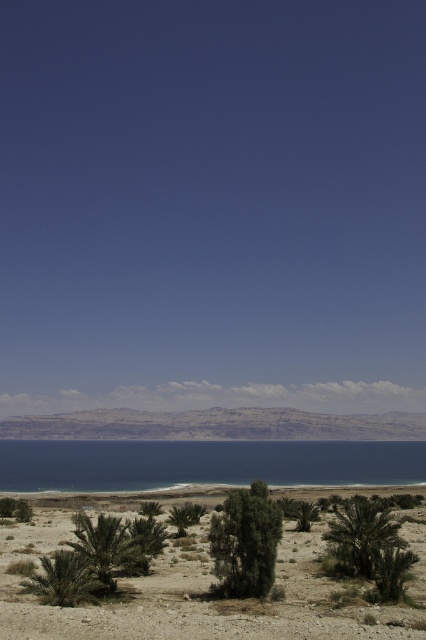
Who is more forward, (367, 532) or (121, 528)?

Point (121, 528)

Is green leafy palm tree at lower right closer to camera compared to green leafy palm tree at lower center?

No, green leafy palm tree at lower right is behind green leafy palm tree at lower center.

Who is more forward, (x=359, y=557) or (x=77, y=547)?

Point (x=77, y=547) is in front.

Locate an element on the screen. Image resolution: width=426 pixels, height=640 pixels. green leafy palm tree at lower right is located at coordinates (360, 536).

Can you confirm if green leafy bush at center is shorter than green leafy palm tree at lower center?

Yes, green leafy bush at center is shorter than green leafy palm tree at lower center.

Between green leafy bush at center and green leafy palm tree at lower center, which one is positioned lower?

green leafy palm tree at lower center

Identify the location of green leafy bush at center. (245, 541).

Can you confirm if blue water at center is taller than green leafy palm tree at lower left?

Yes, blue water at center is taller than green leafy palm tree at lower left.

Between point (399, 467) and point (37, 582), which one is positioned in front?

Point (37, 582) is more forward.

The image size is (426, 640). Identify the location of blue water at center. click(x=203, y=464).